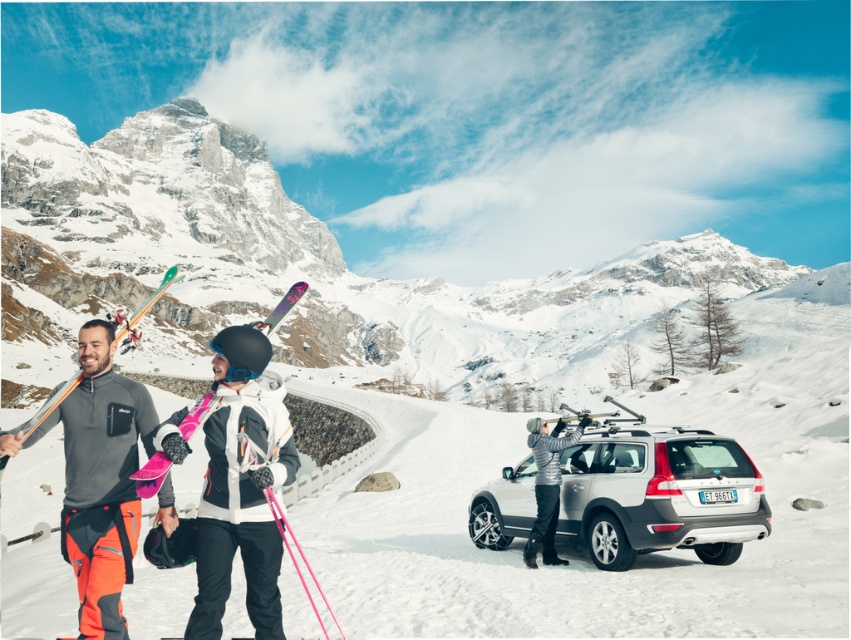
You are a photographer standing in the snowy slope. You want to take a photo of the white matte suv at center and the matte pink snowboard at center. Based on their positions, which object is located to the right side of the other?

The white matte suv at center is located to the right of the matte pink snowboard at center.

You are a photographer standing at the bottom of the slope. You want to take a photo of the matte pink snowboard at center and the silver metallic jacket at center so that both are clearly visible. Based on their positions, which object should you focus on first to ensure both are in focus?

The silver metallic jacket at center is lower than the matte pink snowboard at center. To ensure both are in focus, you should focus on the silver metallic jacket at center first since it is closer to the camera, and the snowboard will naturally fall into the depth of field.